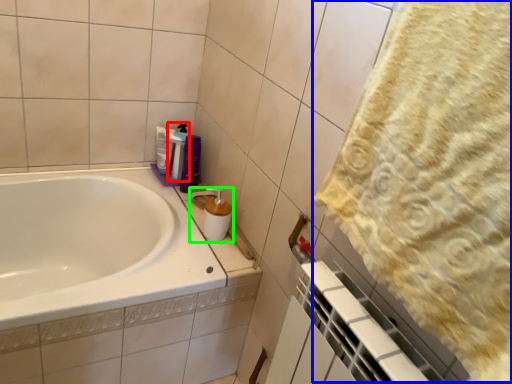
Question: Which object is positioned closest to cleaning product (highlighted by a red box)? Select from bath towel (highlighted by a blue box) and soap dispenser (highlighted by a green box).

Choices:
 (A) bath towel
 (B) soap dispenser

Answer: (B)